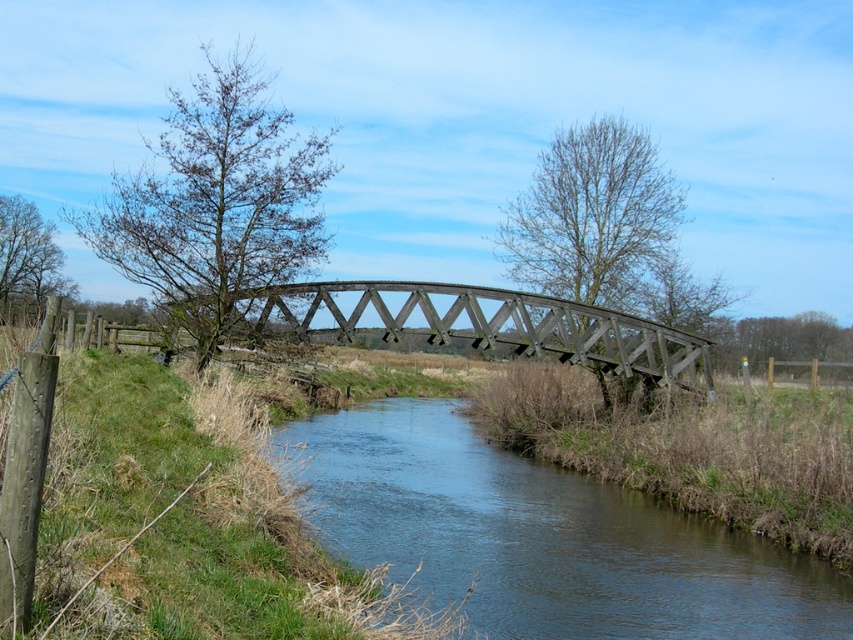
You are a hiker who wants to cross the river using the bridge. However, you notice that the dark brown water at center and the dark brown wooden bridge at center are both dark brown in color. How can you tell which one is higher from your current position?

The dark brown wooden bridge at center is taller than the dark brown water at center, so the bridge is higher and can be safely crossed.

You are standing on the wooden bridge and want to walk towards the point labeled as point (305, 326). However, you notice another point labeled point (604, 497) further along your path. Based on their positions, which point will you encounter first as you move forward?

You will encounter point (305, 326) first because it is closer to your starting position on the bridge, while point (604, 497) is located behind it in the direction of travel.

You are standing on the dark brown wooden bridge at center and want to cross to the other side. Which direction should you walk to avoid stepping into the dark brown water at center?

You should walk to the left to avoid stepping into the dark brown water at center, as the dark brown water at center is to the right of the dark brown wooden bridge at center.